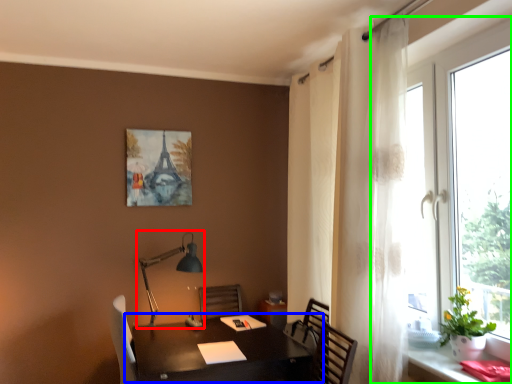
Question: Which object is the closest to the table lamp (highlighted by a red box)? Choose among these: table (highlighted by a blue box) or window (highlighted by a green box).

Choices:
 (A) table
 (B) window

Answer: (A)